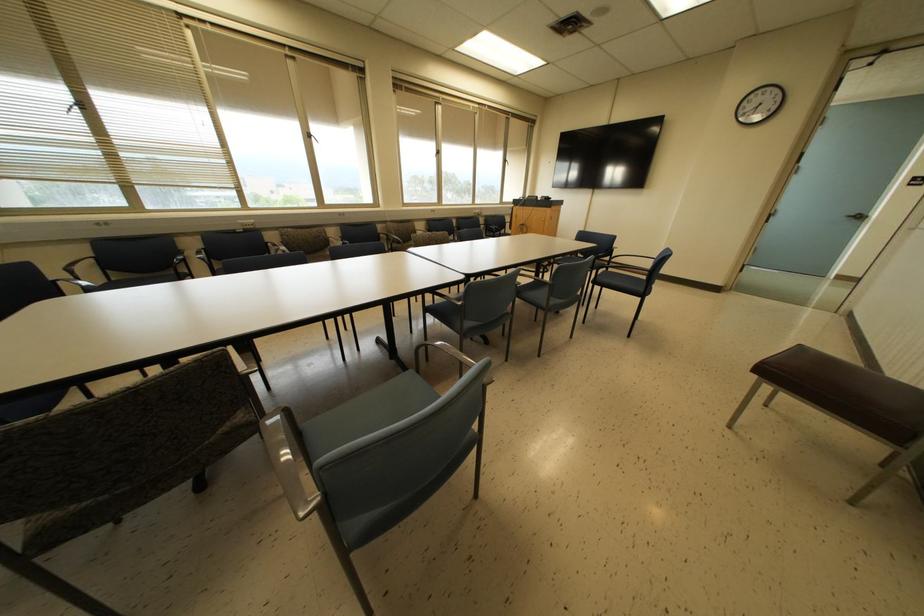
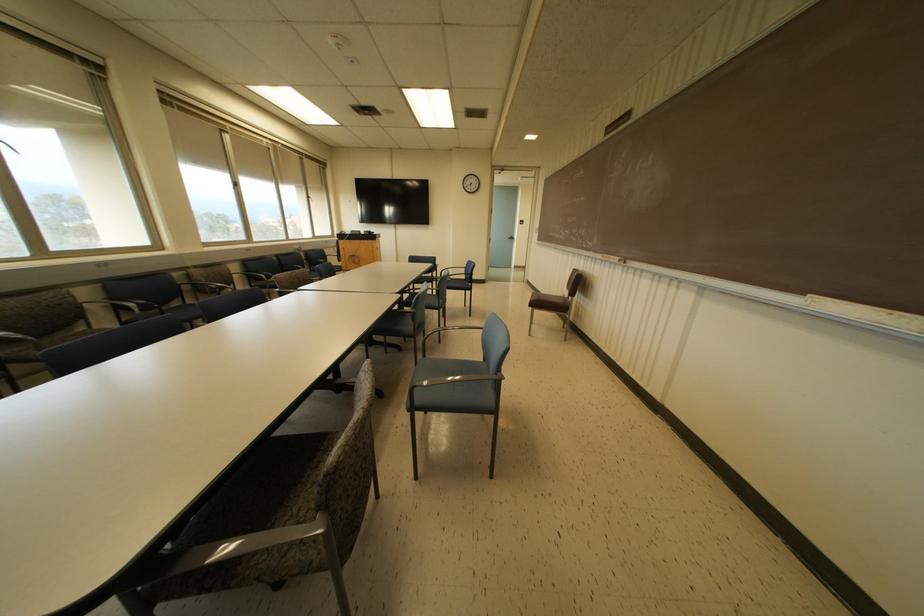
The point at [859,217] is marked in the first image. Where is the corresponding point in the second image?

(512, 238)